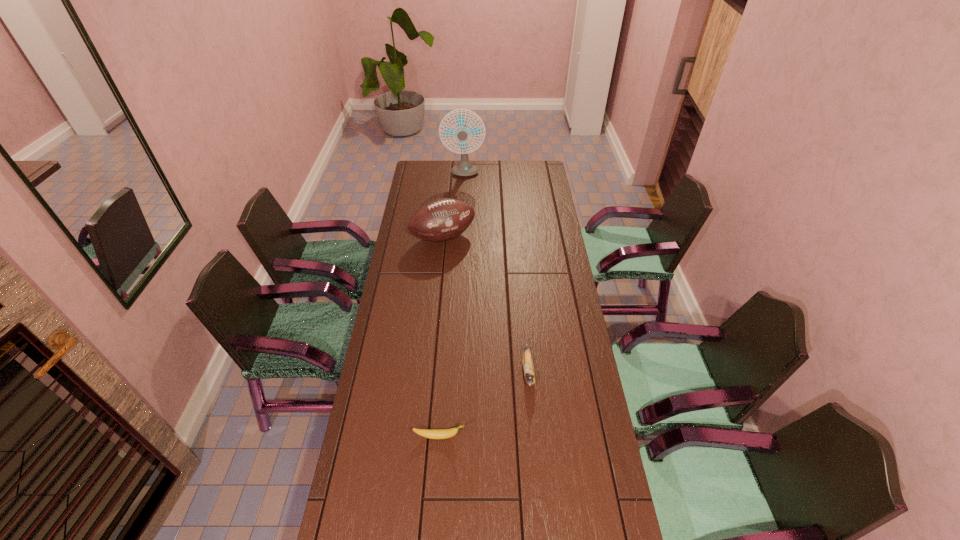
Identify the location of vacant space that's between the second farthest object and the right banana. (486, 305).

The width and height of the screenshot is (960, 540). In order to click on free spot between the second tallest object and the shorter banana in this screenshot , I will do `click(442, 337)`.

Locate an element on the screen. The image size is (960, 540). free spot between the taller banana and the fan is located at coordinates (496, 273).

Where is `free space between the nearest object and the right banana`? The height and width of the screenshot is (540, 960). free space between the nearest object and the right banana is located at coordinates (484, 404).

At what (x,y) coordinates should I click in order to perform the action: click on vacant space that's between the shortest object and the third nearest object. Please return your answer as a coordinate pair (x, y). The image size is (960, 540). Looking at the image, I should click on (442, 337).

Where is `free area in between the second farthest object and the left banana`? This screenshot has width=960, height=540. free area in between the second farthest object and the left banana is located at coordinates (442, 337).

The image size is (960, 540). Identify the location of vacant area between the nearer banana and the tallest object. (451, 306).

I want to click on blank region between the second farthest object and the shorter banana, so click(x=442, y=337).

Identify the location of the third closest object to the fan. (427, 433).

This screenshot has height=540, width=960. Find the location of `object that can be found as the second closest to the nearest object`. object that can be found as the second closest to the nearest object is located at coordinates (443, 219).